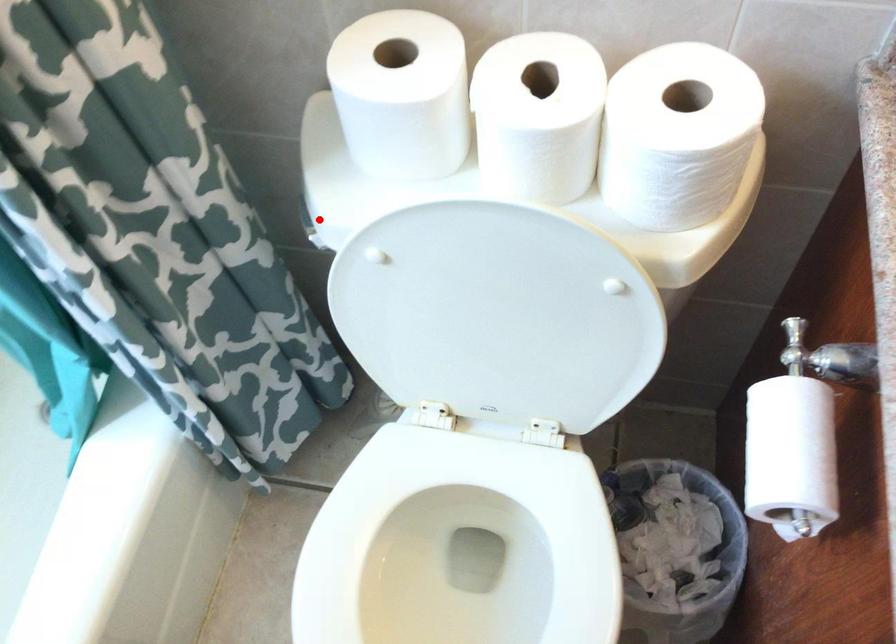
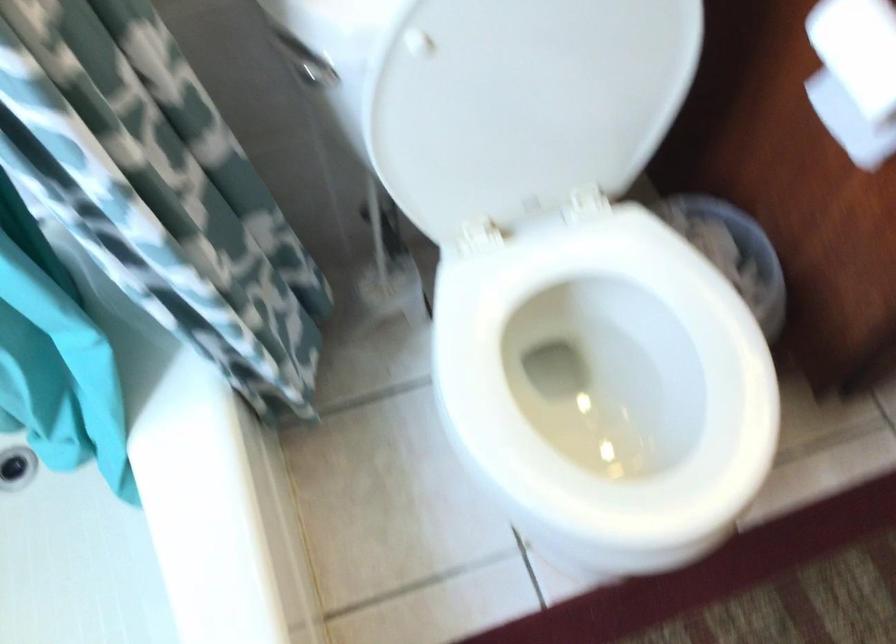
The point at the highlighted location is marked in the first image. Where is the corresponding point in the second image?

(304, 64)